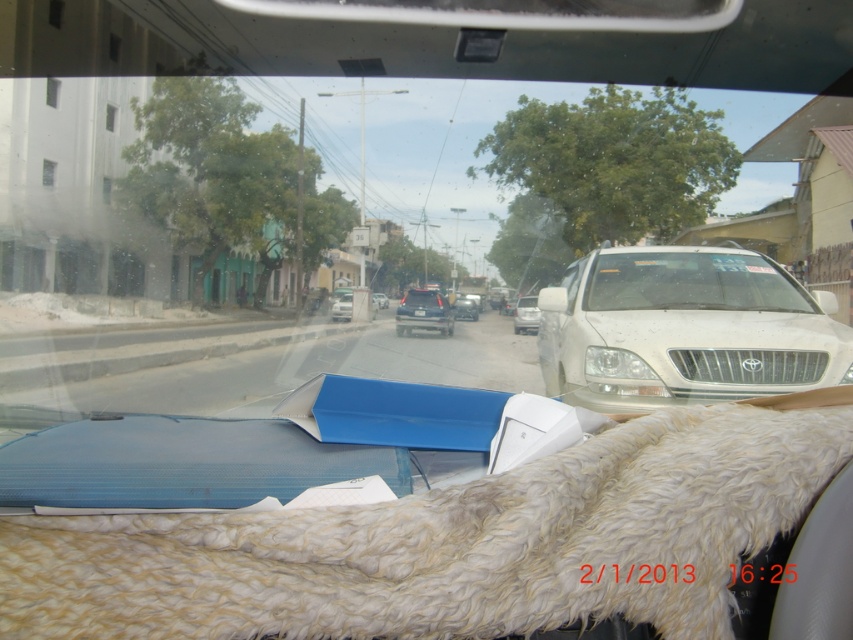
Can you confirm if clear glass windshield at center is taller than satin blue sedan at center?

In fact, clear glass windshield at center may be shorter than satin blue sedan at center.

Does point (697, 268) lie in front of point (405, 294)?

Yes, point (697, 268) is closer to viewer.

What do you see at coordinates (692, 282) in the screenshot? The width and height of the screenshot is (853, 640). I see `clear glass windshield at center` at bounding box center [692, 282].

At what (x,y) coordinates should I click in order to perform the action: click on clear glass windshield at center. Please return your answer as a coordinate pair (x, y). Looking at the image, I should click on (692, 282).

Where is `fuzzy wool blanket at lower center`? The width and height of the screenshot is (853, 640). fuzzy wool blanket at lower center is located at coordinates (451, 541).

Which is in front, point (515, 627) or point (334, 317)?

Point (515, 627) is more forward.

Find the location of a particular element. The width and height of the screenshot is (853, 640). fuzzy wool blanket at lower center is located at coordinates (451, 541).

Which is in front, point (347, 305) or point (422, 316)?

Point (422, 316) is more forward.

Which is in front, point (347, 294) or point (421, 316)?

Point (421, 316) is in front.

This screenshot has height=640, width=853. Identify the location of satin silver car at center. (341, 305).